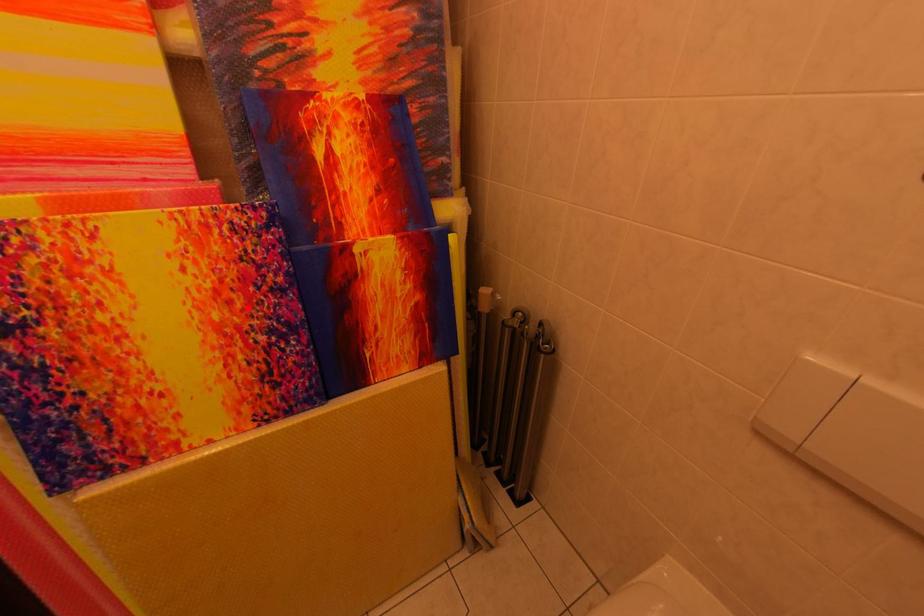
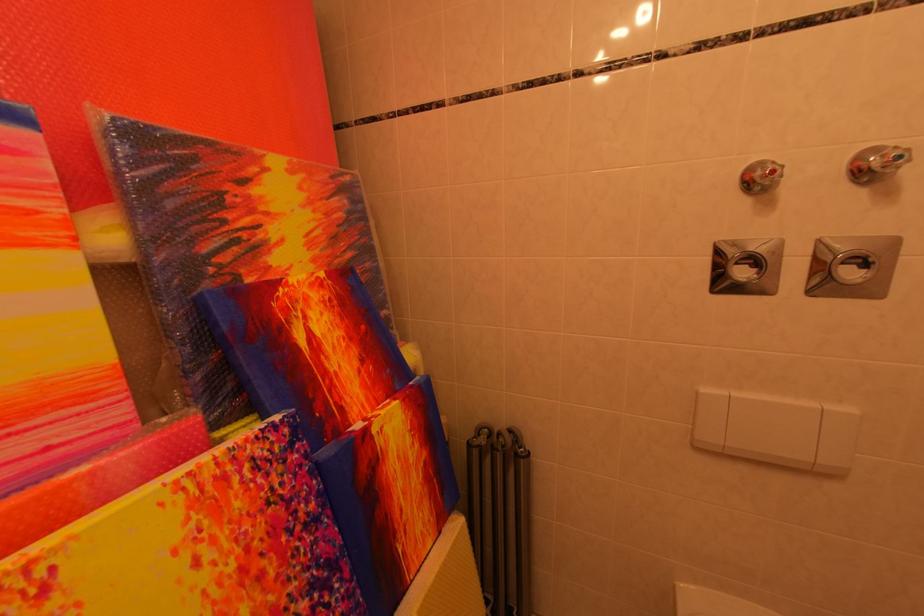
In the second image, find the point that corresponds to the highlighted location in the first image.

(281, 575)